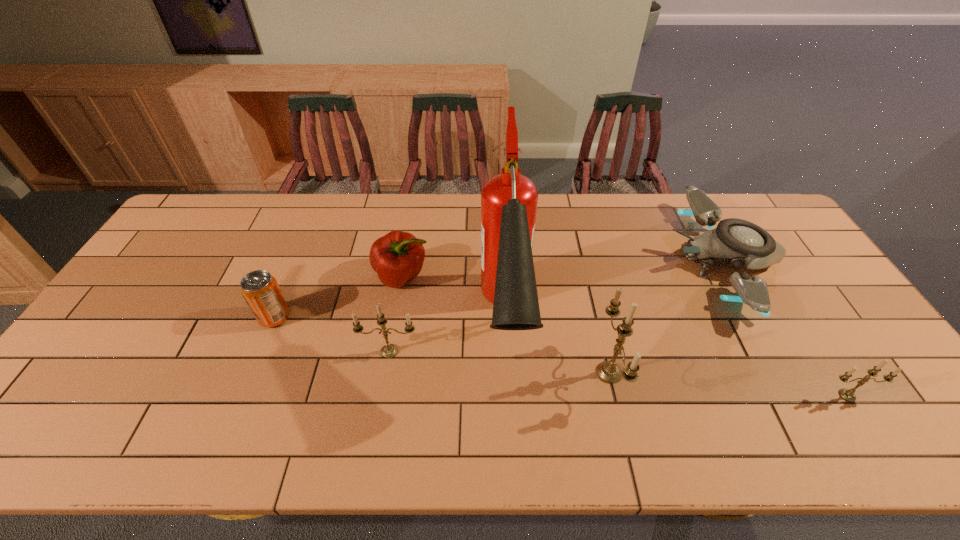
Image resolution: width=960 pixels, height=540 pixels. Identify the location of candle that is at the right edge. (848, 395).

Locate an element on the screen. This screenshot has width=960, height=540. drone located in the right edge section of the desktop is located at coordinates (737, 242).

The image size is (960, 540). Find the location of `object present at the far right corner`. object present at the far right corner is located at coordinates (737, 242).

At what (x,y) coordinates should I click in order to perform the action: click on object that is at the near right corner. Please return your answer as a coordinate pair (x, y). Looking at the image, I should click on click(x=848, y=395).

Where is `free space at the far edge of the desktop`? This screenshot has height=540, width=960. free space at the far edge of the desktop is located at coordinates click(276, 212).

Find the location of a particular element. vacant space at the near edge of the desktop is located at coordinates (777, 383).

Where is `free space between the shortest object and the rightmost candle`? This screenshot has height=540, width=960. free space between the shortest object and the rightmost candle is located at coordinates click(x=785, y=328).

This screenshot has height=540, width=960. I want to click on free space that is in between the sixth shortest object and the leftmost candle, so click(x=499, y=362).

I want to click on empty space that is in between the second shortest candle and the sixth shortest object, so [x=499, y=362].

The image size is (960, 540). In order to click on free spot between the rightmost candle and the tallest object in this screenshot , I will do `click(677, 360)`.